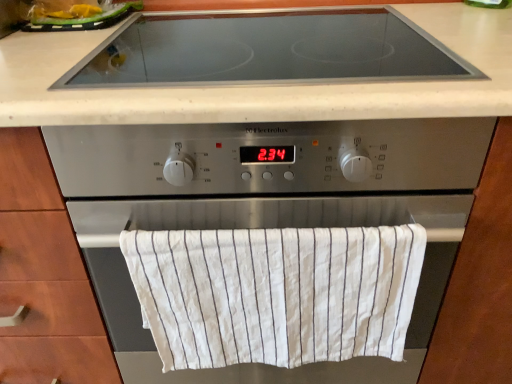
Where is `satin silver oven at center`? The image size is (512, 384). satin silver oven at center is located at coordinates (267, 212).

The height and width of the screenshot is (384, 512). What do you see at coordinates (275, 293) in the screenshot? I see `white striped cloth at center` at bounding box center [275, 293].

Locate an element on the screen. This screenshot has height=384, width=512. white striped cloth at center is located at coordinates (275, 293).

At what (x,y) coordinates should I click in order to perform the action: click on black glass cooktop at upper center. Please return your answer as a coordinate pair (x, y). This screenshot has width=512, height=384. Looking at the image, I should click on (261, 86).

In the scene shown: Considering the sizes of white striped cloth at center and satin silver oven at center in the image, is white striped cloth at center taller or shorter than satin silver oven at center?

Clearly, white striped cloth at center is shorter compared to satin silver oven at center.

Is white striped cloth at center located outside satin silver oven at center?

No.

Does white striped cloth at center have a greater width compared to satin silver oven at center?

No.

What are the coordinates of `bath towel above the satin silver oven at center (from a real-world perspective)` in the screenshot? It's located at (275, 293).

Is white striped cloth at center at the left side of yellow plastic bag at upper left?

No, white striped cloth at center is not to the left of yellow plastic bag at upper left.

Which of these two, white striped cloth at center or yellow plastic bag at upper left, is smaller?

Smaller between the two is yellow plastic bag at upper left.

Is white striped cloth at center spatially inside yellow plastic bag at upper left, or outside of it?

white striped cloth at center is outside yellow plastic bag at upper left.

Does white striped cloth at center turn towards yellow plastic bag at upper left?

No, white striped cloth at center is not turned towards yellow plastic bag at upper left.

From the image's perspective, is black glass cooktop at upper center positioned above or below satin silver oven at center?

black glass cooktop at upper center is situated higher than satin silver oven at center in the image.

Is black glass cooktop at upper center far away from satin silver oven at center?

No.

Find the location of a particular element. countertop that appears above the satin silver oven at center (from the image's perspective) is located at coordinates (261, 86).

Is black glass cooktop at upper center facing towards satin silver oven at center?

No, black glass cooktop at upper center is not facing towards satin silver oven at center.

Considering the sizes of objects yellow plastic bag at upper left and black glass cooktop at upper center in the image provided, who is bigger, yellow plastic bag at upper left or black glass cooktop at upper center?

Bigger between the two is black glass cooktop at upper center.

Would you say yellow plastic bag at upper left is inside or outside black glass cooktop at upper center?

yellow plastic bag at upper left lies outside black glass cooktop at upper center.

Is yellow plastic bag at upper left far away from black glass cooktop at upper center?

Actually, yellow plastic bag at upper left and black glass cooktop at upper center are a little close together.

From a real-world perspective, is yellow plastic bag at upper left above or below black glass cooktop at upper center?

yellow plastic bag at upper left is above black glass cooktop at upper center.

Considering the sizes of white striped cloth at center and black glass cooktop at upper center in the image, is white striped cloth at center taller or shorter than black glass cooktop at upper center?

Clearly, white striped cloth at center is taller compared to black glass cooktop at upper center.

Which object is thinner, white striped cloth at center or black glass cooktop at upper center?

Thinner between the two is white striped cloth at center.

Who is bigger, white striped cloth at center or black glass cooktop at upper center?

Bigger between the two is black glass cooktop at upper center.

From the image's perspective, does white striped cloth at center appear higher than black glass cooktop at upper center?

No, from the image's perspective, white striped cloth at center is not over black glass cooktop at upper center.

Based on the photo, can we say satin silver oven at center lies outside yellow plastic bag at upper left?

Absolutely, satin silver oven at center is external to yellow plastic bag at upper left.

From a real-world perspective, is satin silver oven at center beneath yellow plastic bag at upper left?

Yes, from a real-world perspective, satin silver oven at center is below yellow plastic bag at upper left.

Which object is wider, satin silver oven at center or yellow plastic bag at upper left?

With larger width is satin silver oven at center.

Is yellow plastic bag at upper left positioned with its back to satin silver oven at center?

That's not correct — yellow plastic bag at upper left is not looking away from satin silver oven at center.

Looking at this image, is yellow plastic bag at upper left smaller than satin silver oven at center?

Indeed, yellow plastic bag at upper left has a smaller size compared to satin silver oven at center.

Which of these two, yellow plastic bag at upper left or satin silver oven at center, stands taller?

satin silver oven at center is taller.

Locate an element on the screen. Image resolution: width=512 pixels, height=384 pixels. bath towel below the satin silver oven at center (from the image's perspective) is located at coordinates (275, 293).

I want to click on bath towel on the right of yellow plastic bag at upper left, so click(x=275, y=293).

Considering their positions, is satin silver oven at center positioned closer to black glass cooktop at upper center than yellow plastic bag at upper left?

Result: Among the two, satin silver oven at center is located nearer to black glass cooktop at upper center.

Estimate the real-world distances between objects in this image. Which object is closer to yellow plastic bag at upper left, white striped cloth at center or black glass cooktop at upper center?

black glass cooktop at upper center is positioned closer to the anchor yellow plastic bag at upper left.

Consider the image. When comparing their distances from black glass cooktop at upper center, does yellow plastic bag at upper left or white striped cloth at center seem closer?

Among the two, white striped cloth at center is located nearer to black glass cooktop at upper center.

Considering their positions, is black glass cooktop at upper center positioned further to yellow plastic bag at upper left than white striped cloth at center?

white striped cloth at center.

Which object lies further to the anchor point satin silver oven at center, yellow plastic bag at upper left or black glass cooktop at upper center?

yellow plastic bag at upper left is further to satin silver oven at center.

From the image, which object appears to be nearer to white striped cloth at center, satin silver oven at center or black glass cooktop at upper center?

satin silver oven at center is closer to white striped cloth at center.

Based on their spatial positions, is black glass cooktop at upper center or white striped cloth at center closer to satin silver oven at center?

white striped cloth at center is closer to satin silver oven at center.

When comparing their distances from black glass cooktop at upper center, does satin silver oven at center or white striped cloth at center seem closer?

satin silver oven at center is positioned closer to the anchor black glass cooktop at upper center.

Locate an element on the screen. The width and height of the screenshot is (512, 384). countertop between yellow plastic bag at upper left and satin silver oven at center in the vertical direction is located at coordinates (261, 86).

Locate an element on the screen. home appliance between yellow plastic bag at upper left and white striped cloth at center from top to bottom is located at coordinates (267, 212).

Where is `countertop between yellow plastic bag at upper left and white striped cloth at center from top to bottom`? The width and height of the screenshot is (512, 384). countertop between yellow plastic bag at upper left and white striped cloth at center from top to bottom is located at coordinates (261, 86).

The image size is (512, 384). What are the coordinates of `home appliance between black glass cooktop at upper center and white striped cloth at center in the vertical direction` in the screenshot? It's located at (267, 212).